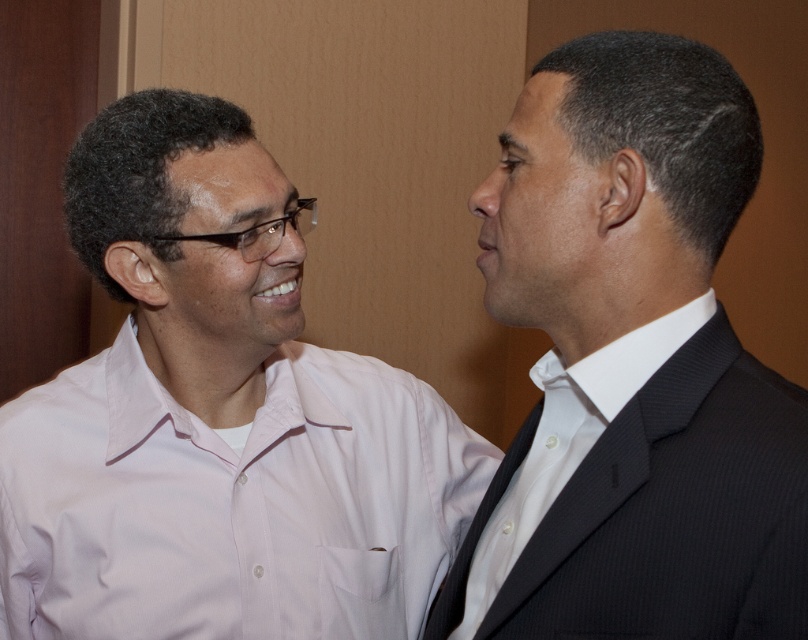
You are a photographer adjusting the focus on your camera. You notice two points in the image at coordinates point (24, 436) and point (608, 419). Which point is closer to you?

Point (24, 436) is further to the viewer than point (608, 419), so the closer point to you is point (608, 419).

You are a photographer setting up a portrait session. You have two subjects in front of you, one wearing a black suit at right and the other wearing a white smooth shirt at right. Which clothing item has a taller silhouette in the image?

The black suit at right has a greater height compared to the white smooth shirt at right, so the black suit at right has a taller silhouette.

You are a tailor measuring shirts for alterations. You have a pink cotton shirt at left and a white smooth shirt at right. Which shirt requires a longer sleeve length adjustment?

The pink cotton shirt at left requires a longer sleeve length adjustment because it is much taller than the white smooth shirt at right.